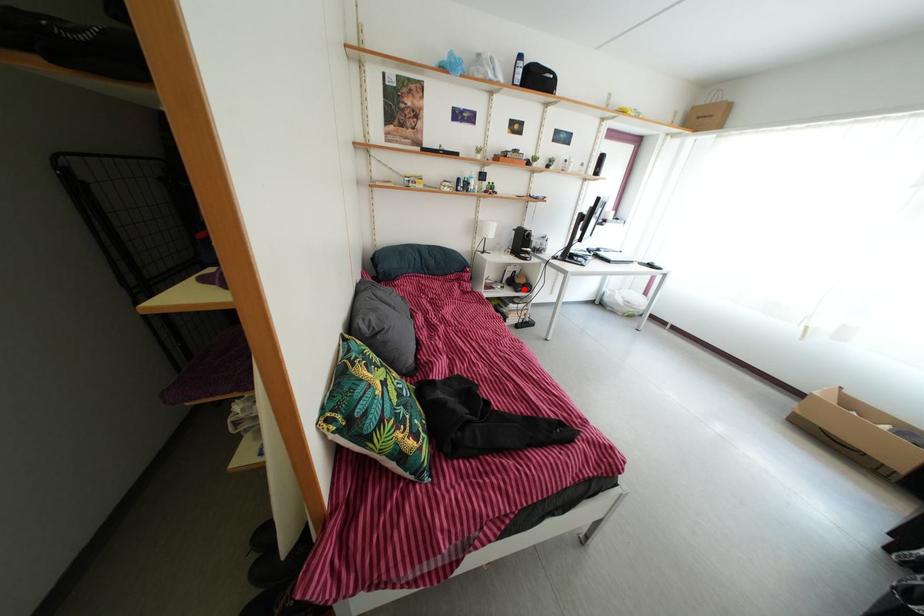
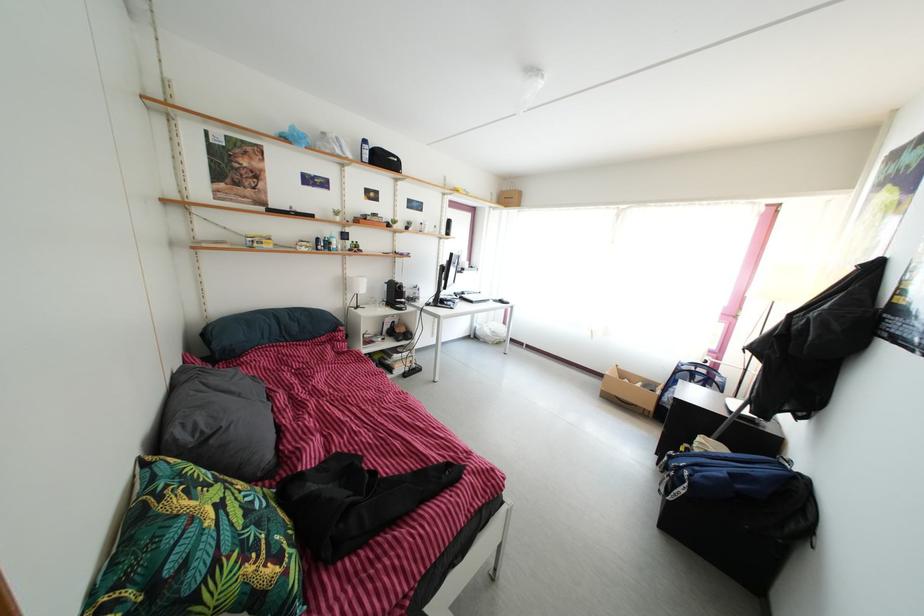
Find the pixel in the second image that matches the highlighted location in the first image.

(405, 339)